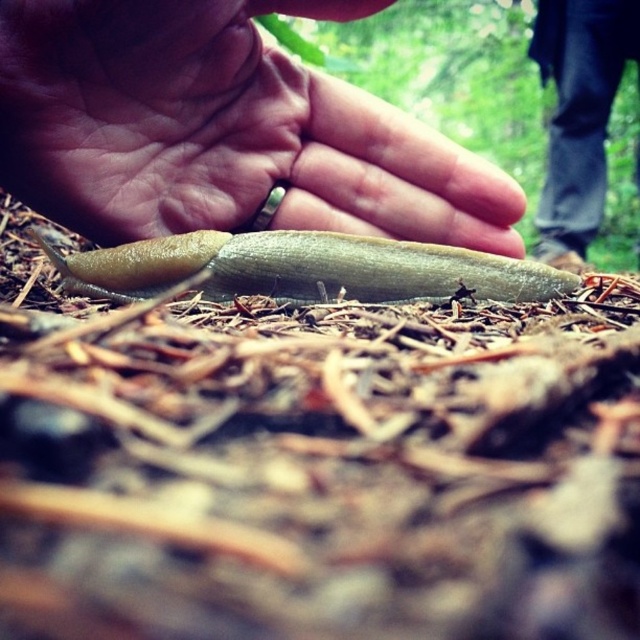
Question: Is matte gold ring at center above green slimy snail at center?

Choices:
 (A) no
 (B) yes

Answer: (B)

Question: Which of the following is the closest to the observer?

Choices:
 (A) matte gold ring at center
 (B) green slimy snail at center

Answer: (A)

Question: Is matte gold ring at center above green slimy snail at center?

Choices:
 (A) yes
 (B) no

Answer: (A)

Question: Which of the following is the farthest from the observer?

Choices:
 (A) (148, 257)
 (B) (35, 106)

Answer: (B)

Question: Which object appears farthest from the camera in this image?

Choices:
 (A) matte gold ring at center
 (B) green slimy snail at center

Answer: (B)

Question: In this image, where is matte gold ring at center located relative to green slimy snail at center?

Choices:
 (A) below
 (B) above

Answer: (B)